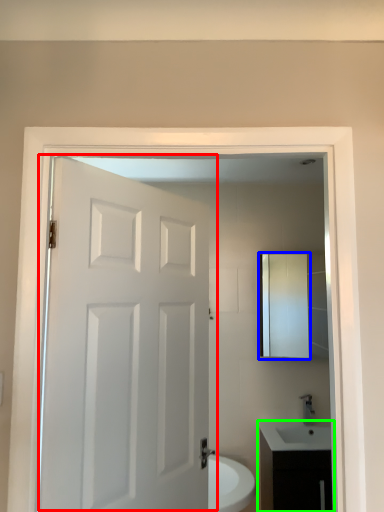
Question: Considering the real-world distances, which object is closest to door (highlighted by a red box)? medicine cabinet (highlighted by a blue box) or bathroom cabinet (highlighted by a green box).

Choices:
 (A) medicine cabinet
 (B) bathroom cabinet

Answer: (B)